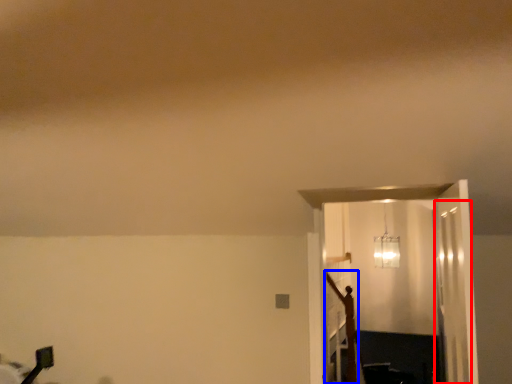
Question: Which object appears farthest to the camera in this image, glass door (highlighted by a red box) or crucifix (highlighted by a blue box)?

Choices:
 (A) glass door
 (B) crucifix

Answer: (B)